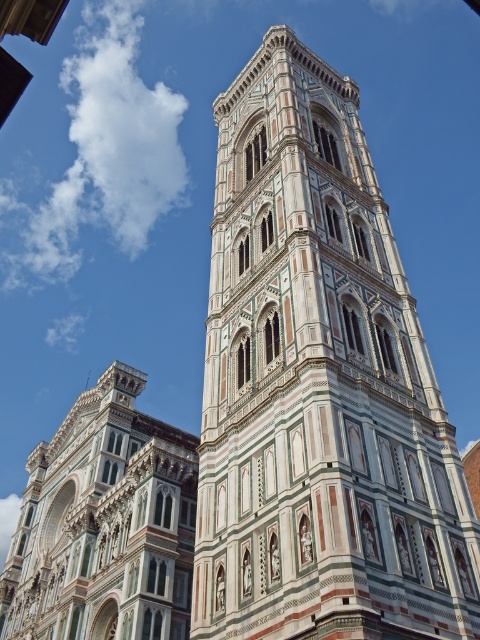
You are an architect analyzing the cathedral complex. You observe the multicolored stone tower at center and the multicolored mosaic tower at center. Which tower has a smaller width?

The multicolored stone tower at center is thinner than the multicolored mosaic tower at center, so the multicolored stone tower at center has a smaller width.

You are standing in front of the bell tower and looking at two points marked on the image. The first point is at coordinate point (x=254, y=365) and the second is at point (x=134, y=563). Which point is closer to your eyes?

Point (x=254, y=365) is closer to the camera than point (x=134, y=563).